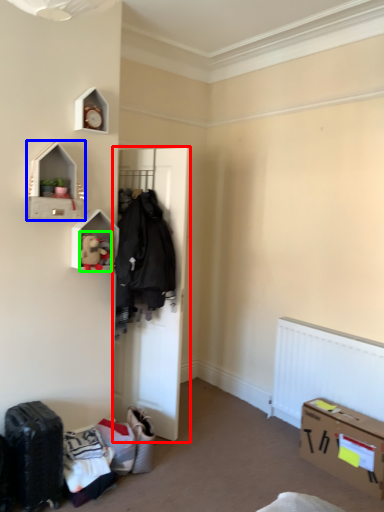
Question: Which is nearer to the door (highlighted by a red box)? shelf (highlighted by a blue box) or toy (highlighted by a green box).

Choices:
 (A) shelf
 (B) toy

Answer: (B)